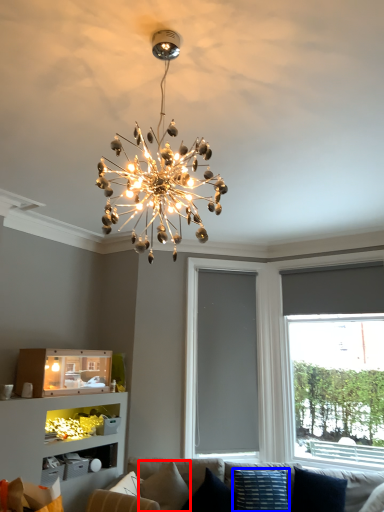
Question: Which object is further to the camera taking this photo, pillow (highlighted by a red box) or pillow (highlighted by a blue box)?

Choices:
 (A) pillow
 (B) pillow

Answer: (A)